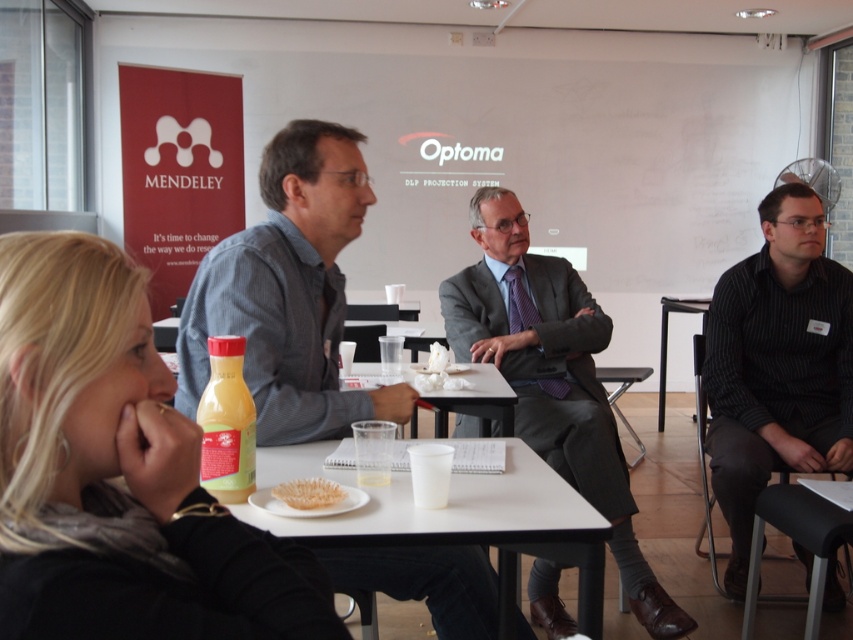
What is located at the coordinates point (552, 378)?

The dark gray suit at center is located at point (552, 378).

Based on the scene, which object is positioned higher in the image between the dark gray suit at center and the translucent plastic bowl at center?

The dark gray suit at center is positioned higher than the translucent plastic bowl at center.

You are a person who is 5 feet tall. You want to sit at the table and reach the items on the table. Can you comfortably reach the items on the white plastic table at center from the dark gray suit at center?

The distance between dark gray suit at center and white plastic table at center is 34.77 inches. Since the average arm length for a 5 foot tall person is about 26 inches, they may not comfortably reach the items on the white plastic table at center from the dark gray suit at center without moving closer.